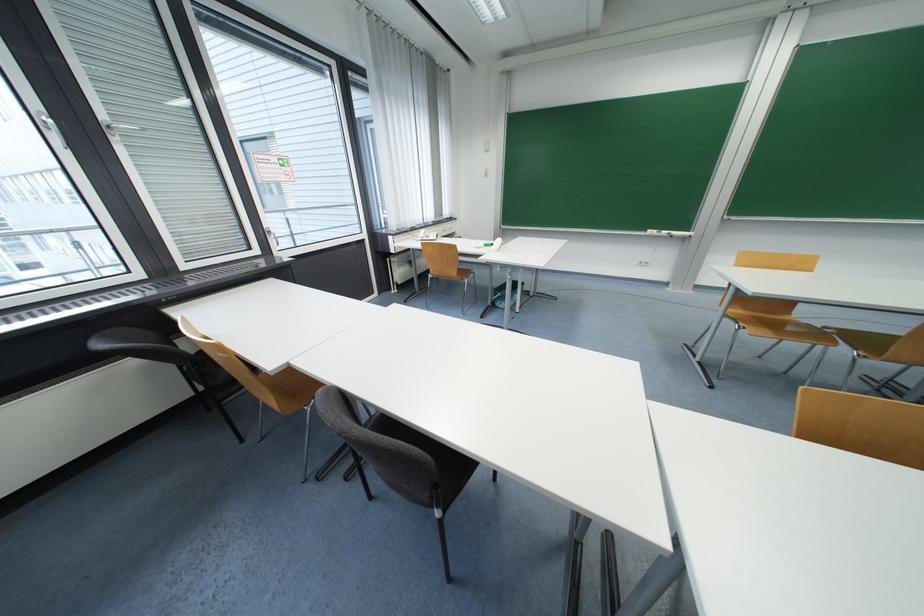
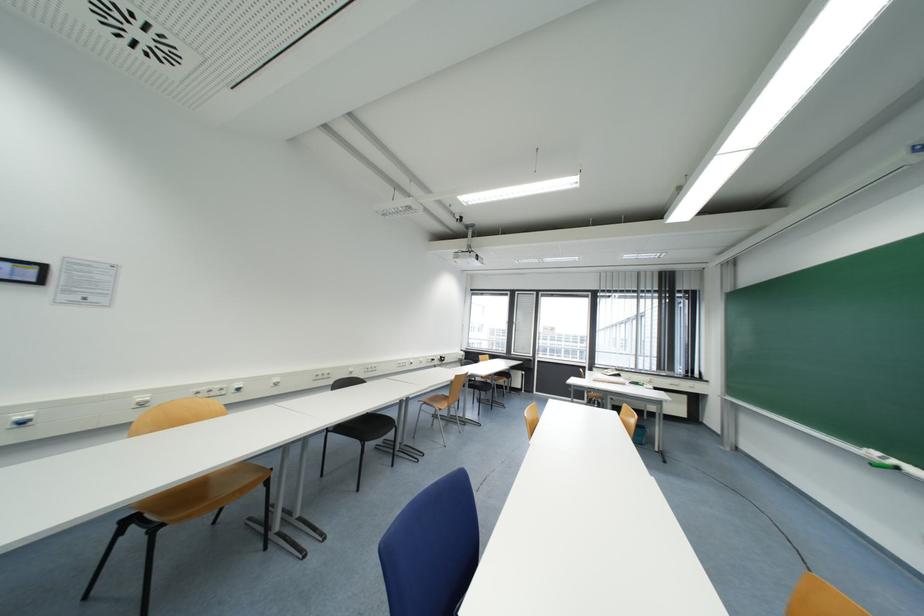
Locate, in the second image, the point that corresponds to point 670,233 in the first image.

(898, 464)